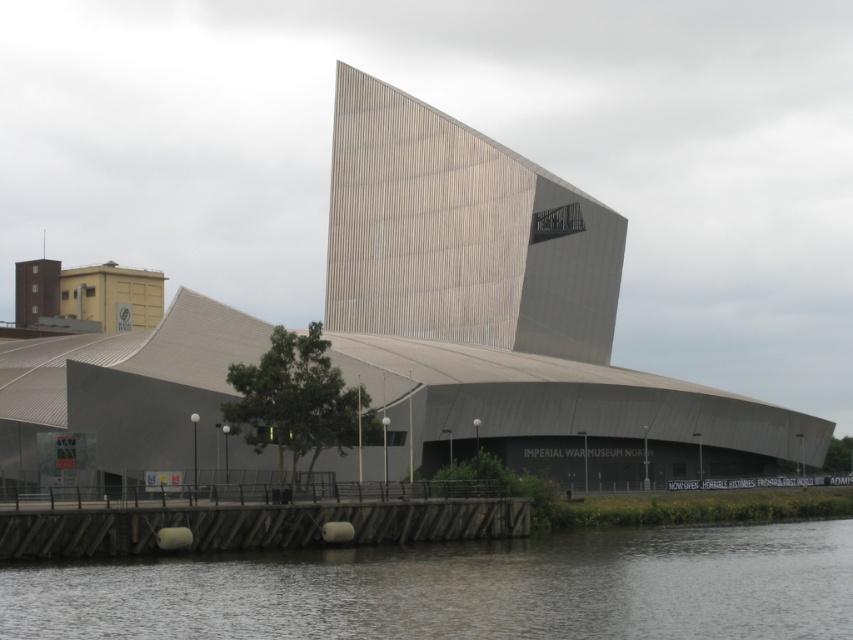
Question: Does dark gray water at lower center lie behind gray textured building at center?

Choices:
 (A) yes
 (B) no

Answer: (B)

Question: Does dark gray water at lower center appear under gray textured building at center?

Choices:
 (A) yes
 (B) no

Answer: (A)

Question: Which point is closer to the camera taking this photo?

Choices:
 (A) (416, 179)
 (B) (786, 595)

Answer: (B)

Question: Which point is closer to the camera?

Choices:
 (A) dark gray water at lower center
 (B) gray textured building at center

Answer: (A)

Question: Where is dark gray water at lower center located in relation to gray textured building at center in the image?

Choices:
 (A) below
 (B) above

Answer: (A)

Question: Which point is closer to the camera taking this photo?

Choices:
 (A) (376, 308)
 (B) (729, 589)

Answer: (B)